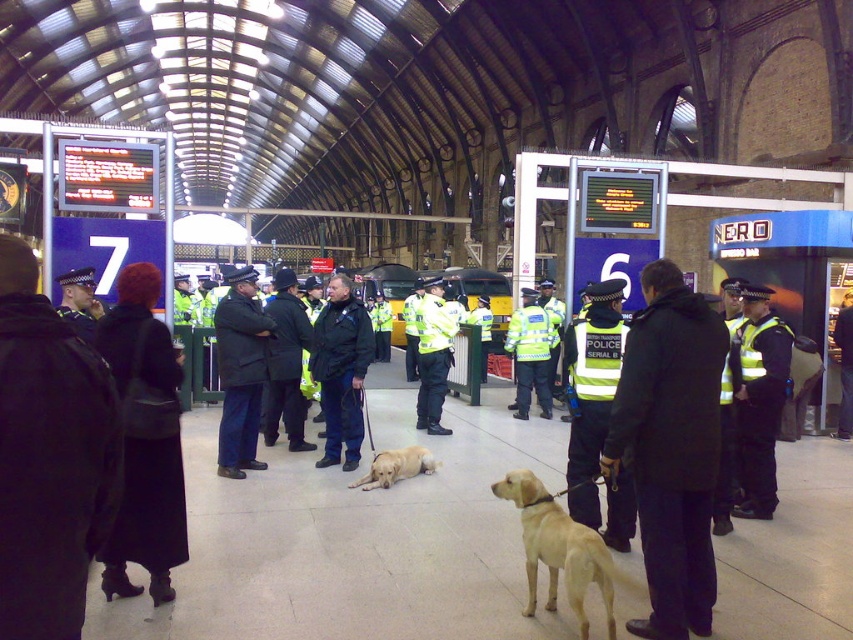
Question: Which point is closer to the camera?

Choices:
 (A) (355, 369)
 (B) (523, 516)
 (C) (434, 314)

Answer: (B)

Question: Which point appears closest to the camera in this image?

Choices:
 (A) [x=134, y=472]
 (B) [x=274, y=365]

Answer: (A)

Question: Is dark blue uniform at center behind golden fur dog at center?

Choices:
 (A) no
 (B) yes

Answer: (B)

Question: Does dark blue coat at center come in front of dark blue uniform at center?

Choices:
 (A) yes
 (B) no

Answer: (A)

Question: Which of the following is the farthest from the observer?

Choices:
 (A) high-visibility yellow vest at center
 (B) dark gray uniform at center
 (C) high-visibility yellow jacket at center

Answer: (C)

Question: Does dark blue coat at center appear under dark blue uniform at center?

Choices:
 (A) no
 (B) yes

Answer: (B)